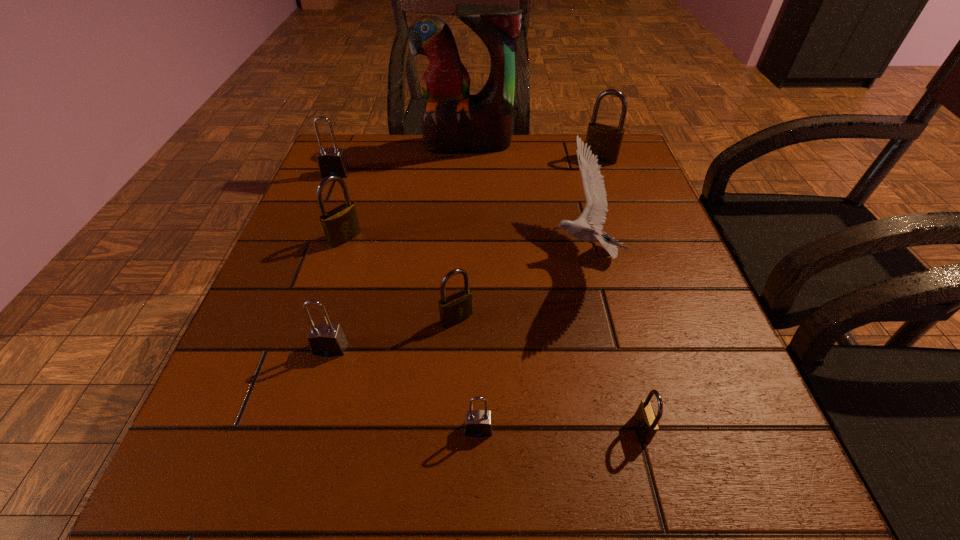
Identify the location of the third biggest brass padlock. (455, 308).

Identify the location of the second nearest brass padlock. The height and width of the screenshot is (540, 960). (x=455, y=308).

Image resolution: width=960 pixels, height=540 pixels. Identify the location of the nearest gray padlock. (478, 423).

Image resolution: width=960 pixels, height=540 pixels. Identify the location of the rightmost gray padlock. (478, 423).

This screenshot has height=540, width=960. I want to click on the nearest brass padlock, so click(x=646, y=422).

The image size is (960, 540). In order to click on the second brass padlock from right to left in this screenshot , I will do `click(646, 422)`.

At what (x,y) coordinates should I click in order to perform the action: click on free space located at the face of the tallest object. Please return your answer as a coordinate pair (x, y). Looking at the image, I should click on (464, 245).

Find the location of `free space located 0.190m on the front of the farthest brass padlock`. free space located 0.190m on the front of the farthest brass padlock is located at coordinates (618, 210).

Where is `vacant space located 0.060m at the tip of the beak of the white gull`? vacant space located 0.060m at the tip of the beak of the white gull is located at coordinates (519, 254).

This screenshot has width=960, height=540. What are the coordinates of `vacant space located 0.350m at the tip of the beak of the white gull` in the screenshot? It's located at (375, 254).